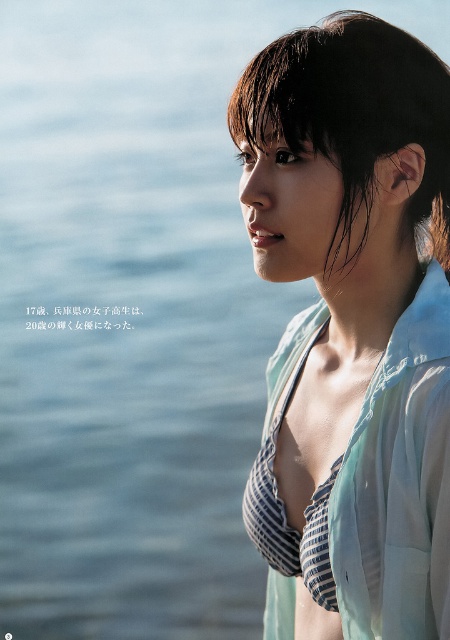
From the picture: You are a photographer trying to capture the woman in the scene. You want to ensure both the wet dark brown hair at upper center and the dark brown hair at upper right are visible in your shot. Based on their positions, which hair section is higher in the frame?

The wet dark brown hair at upper center is higher in the frame than the dark brown hair at upper right because it is taller.

Please provide the 2D coordinates of the wet dark brown hair at upper center in the image. The coordinates should be in the format of a tuple with two decimal numbers between 0 and 1, where 0 represents the bottom left corner and 1 represents the top right corner of the image.

The 2D coordinates of the wet dark brown hair at upper center are at point (350, 108).

What is the 2D coordinate of the light blue striped bikini top at center in the image?

The 2D coordinate of the light blue striped bikini top at center is at point (351,330).